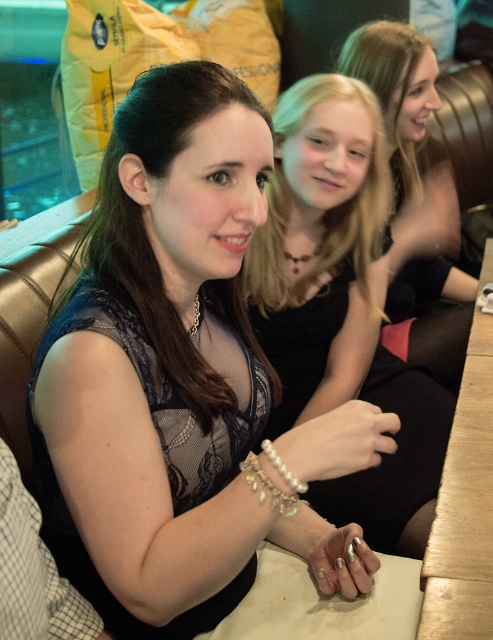
You are a fashion designer observing the image. You need to determine where the point at coordinate [169,372] is located. Based on the scene description, can you identify which object this point is on?

The point at coordinate [169,372] is located on the lace fabric dress at center.

Looking at this image, you are a photographer setting up a shoot in a studio. You have two dresses to photograph, the lace fabric dress at center and the matte black dress at center. The studio has a limited space that can only accommodate one dress at a time. Based on the scene description, which dress should you choose to ensure it fits within the space?

The lace fabric dress at center is bigger than the matte black dress at center, so the matte black dress at center should be chosen as it is smaller and more likely to fit within the limited studio space.